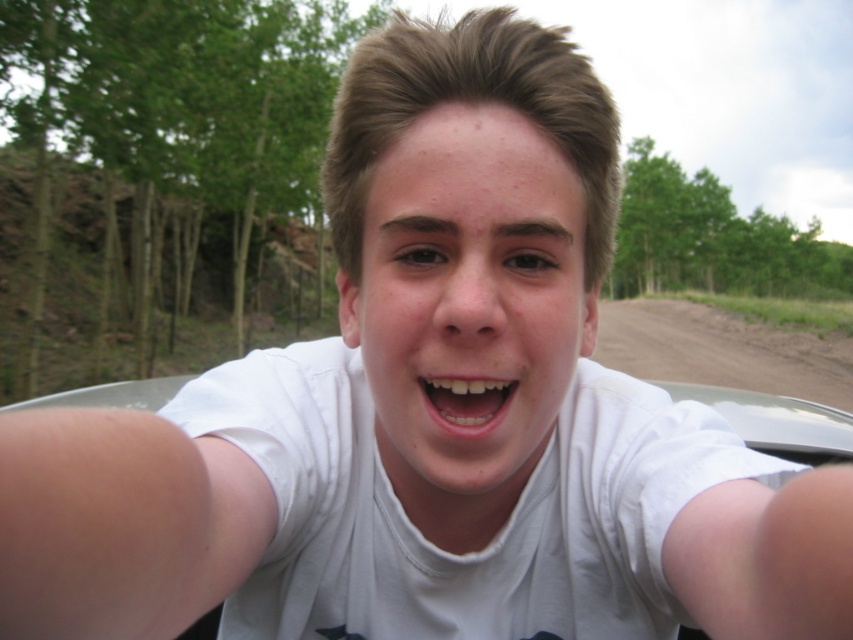
Question: In this image, where is brown dirt track at lower right located relative to white glossy teeth at center?

Choices:
 (A) below
 (B) above

Answer: (B)

Question: Which point is closer to the camera?

Choices:
 (A) white cotton t-shirt at center
 (B) brown dirt track at lower right

Answer: (A)

Question: Is brown dirt track at lower right thinner than white glossy teeth at center?

Choices:
 (A) no
 (B) yes

Answer: (A)

Question: Estimate the real-world distances between objects in this image. Which object is farther from the white glossy teeth at center?

Choices:
 (A) brown dirt track at lower right
 (B) white cotton t-shirt at center

Answer: (A)

Question: Is white cotton t-shirt at center behind white glossy teeth at center?

Choices:
 (A) no
 (B) yes

Answer: (A)

Question: Considering the real-world distances, which object is closest to the white glossy teeth at center?

Choices:
 (A) brown dirt track at lower right
 (B) white cotton t-shirt at center

Answer: (B)